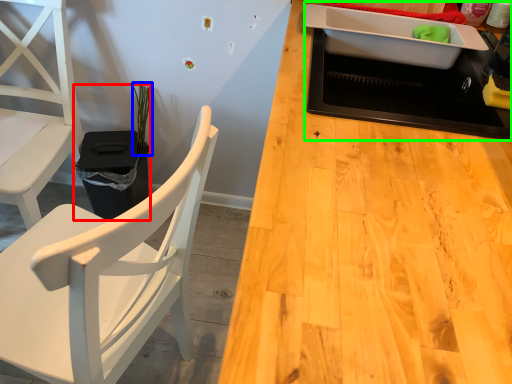
Question: Based on their relative distances, which object is nearer to houseplant (highlighted by a red box)? Choose from plant (highlighted by a blue box) and appliance (highlighted by a green box).

Choices:
 (A) plant
 (B) appliance

Answer: (A)